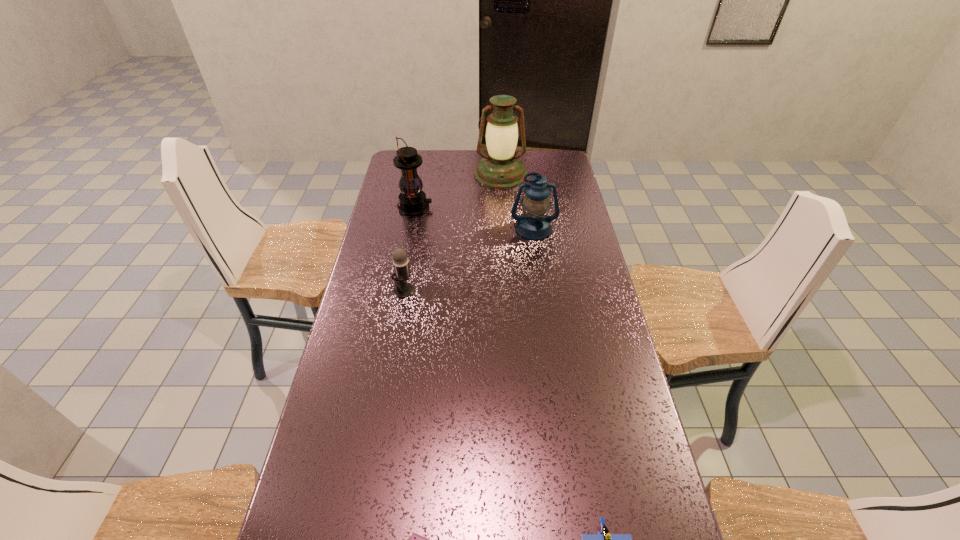
Locate an element on the screen. the farthest lantern is located at coordinates (501, 168).

You are a GUI agent. You are given a task and a screenshot of the screen. Output one action in this format:
    pyautogui.click(x=<x>, y=<y>)
    Task: Click on the leftmost lantern
    The image size is (960, 540).
    Given the screenshot: What is the action you would take?
    pyautogui.click(x=412, y=200)

The height and width of the screenshot is (540, 960). I want to click on the fifth nearest object, so click(412, 200).

Where is `the third farthest object`? This screenshot has width=960, height=540. the third farthest object is located at coordinates (534, 224).

This screenshot has height=540, width=960. In order to click on the third tallest object in this screenshot , I will do `click(534, 224)`.

Find the location of a particular element. This screenshot has width=960, height=540. the fourth tallest object is located at coordinates (400, 260).

Locate an element on the screen. This screenshot has width=960, height=540. the third nearest object is located at coordinates (400, 260).

At what (x,y) coordinates should I click in order to perform the action: click on free region located with the light compartment facing forward on the farthest lantern. Please return your answer as a coordinate pair (x, y). The height and width of the screenshot is (540, 960). Looking at the image, I should click on (504, 234).

Locate several points within the vacant space positioned above the second farthest lantern, indicating its light source. Please provide its 2D coordinates. Your answer should be formatted as a tuple, i.e. [(x, y)], where the tuple contains the x and y coordinates of a point satisfying the conditions above.

[(475, 207)]

You are a GUI agent. You are given a task and a screenshot of the screen. Output one action in this format:
    pyautogui.click(x=<x>, y=<y>)
    Task: Click on the vacant point located 0.210m on the face of the fourth shortest object
    
    Given the screenshot: What is the action you would take?
    pyautogui.click(x=540, y=279)